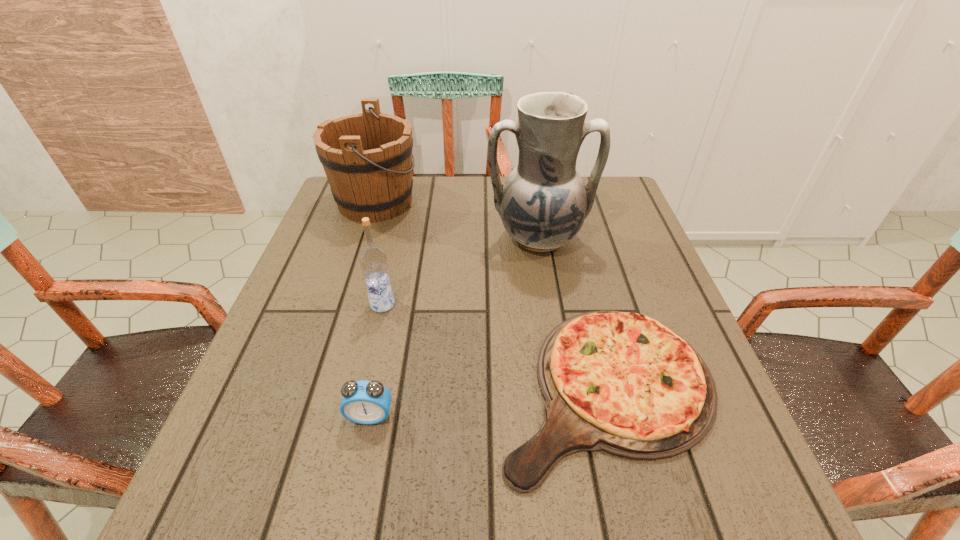
Where is `vacant space at the left edge of the desktop`? The image size is (960, 540). vacant space at the left edge of the desktop is located at coordinates (288, 334).

In the image, there is a desktop. In order to click on free region at the right edge in this screenshot , I will do `click(648, 288)`.

Identify the location of vacant region at the far left corner of the desktop. (326, 210).

You are a GUI agent. You are given a task and a screenshot of the screen. Output one action in this format:
    pyautogui.click(x=<x>, y=<y>)
    Task: Click on the free space at the near left corner of the desktop
    Image resolution: width=960 pixels, height=540 pixels.
    Given the screenshot: What is the action you would take?
    pyautogui.click(x=264, y=466)

This screenshot has width=960, height=540. In order to click on vacant point at the far right corner in this screenshot , I will do `click(607, 223)`.

Where is `vacant space that's between the vodka and the alarm clock`? Image resolution: width=960 pixels, height=540 pixels. vacant space that's between the vodka and the alarm clock is located at coordinates (376, 360).

Find the location of `free point between the pitcher and the wine bucket`. free point between the pitcher and the wine bucket is located at coordinates (457, 220).

Image resolution: width=960 pixels, height=540 pixels. Identify the location of free space between the tallest object and the alarm clock. (454, 327).

Image resolution: width=960 pixels, height=540 pixels. Find the location of `vacant area that lies between the pizza and the tallest object`. vacant area that lies between the pizza and the tallest object is located at coordinates (572, 314).

Identify the location of free spot between the fourth tallest object and the pitcher. (454, 327).